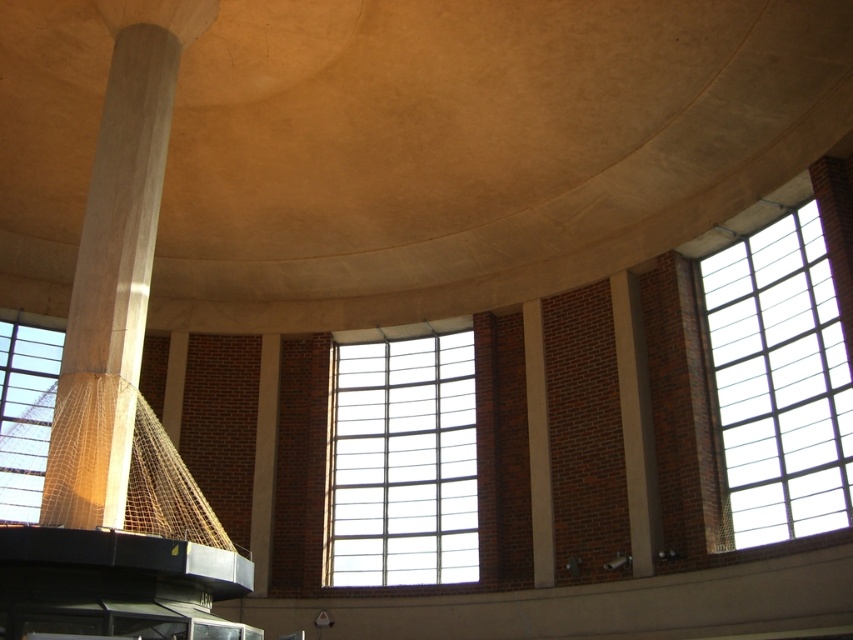
Question: Which point is closer to the camera?

Choices:
 (A) (454, 401)
 (B) (33, 410)

Answer: (B)

Question: Considering the real-world distances, which object is farthest from the clear glass window at left?

Choices:
 (A) white concrete beam at center
 (B) clear glass window at center
 (C) smooth concrete pillar at left

Answer: (A)

Question: Is clear glass window at center smaller than smooth concrete beam at center-right?

Choices:
 (A) yes
 (B) no

Answer: (B)

Question: Where is clear glass window at center located in relation to smooth concrete beam at center-right in the image?

Choices:
 (A) left
 (B) right

Answer: (A)

Question: Does clear glass window at center appear on the right side of white concrete beam at center?

Choices:
 (A) yes
 (B) no

Answer: (B)

Question: Which point appears closest to the camera in this image?

Choices:
 (A) (424, 436)
 (B) (735, 285)

Answer: (B)